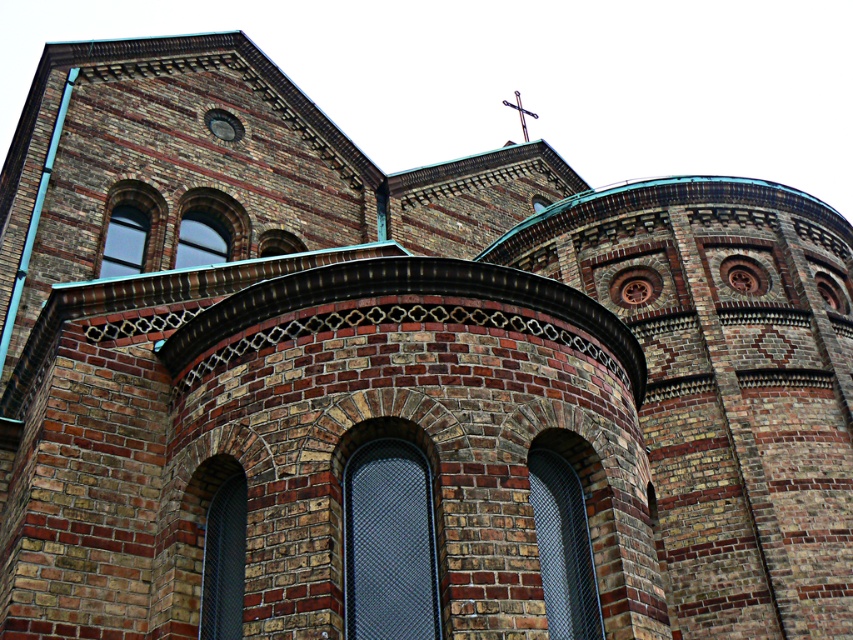
Can you confirm if dark gray mesh window at center is smaller than metallic mesh window at center?

No.

Does dark gray mesh window at center come in front of metallic mesh window at center?

Yes, dark gray mesh window at center is closer to the viewer.

The height and width of the screenshot is (640, 853). Describe the element at coordinates (389, 544) in the screenshot. I see `dark gray mesh window at center` at that location.

Identify the location of dark gray mesh window at center. The image size is (853, 640). (389, 544).

Is clear glass window at center further to the viewer compared to translucent glass window at upper left?

That is False.

Does point (212, 467) lie behind point (186, 257)?

No, it is not.

Is point (223, 524) closer to camera compared to point (204, 240)?

Yes, point (223, 524) is closer to viewer.

The height and width of the screenshot is (640, 853). In order to click on clear glass window at center in this screenshot , I will do `click(216, 544)`.

Between dark gray mesh window at center and translucent glass window at upper left, which one appears on the left side from the viewer's perspective?

translucent glass window at upper left

Is point (418, 572) farther from camera compared to point (219, 243)?

No, it is in front of (219, 243).

Identify the location of dark gray mesh window at center. (389, 544).